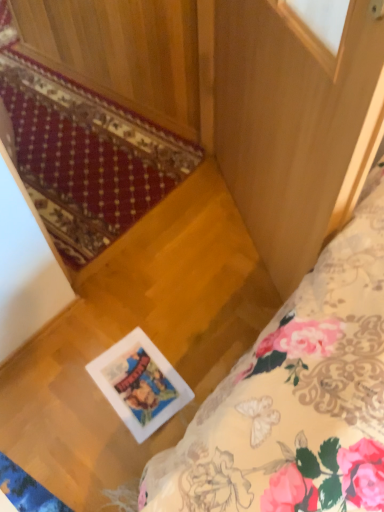
Question: From a real-world perspective, is white glossy picture frame at center on top of floral fabric bed at lower right?

Choices:
 (A) yes
 (B) no

Answer: (B)

Question: Considering the relative sizes of white glossy picture frame at center and floral fabric bed at lower right in the image provided, is white glossy picture frame at center smaller than floral fabric bed at lower right?

Choices:
 (A) no
 (B) yes

Answer: (B)

Question: From the image's perspective, would you say white glossy picture frame at center is positioned over floral fabric bed at lower right?

Choices:
 (A) yes
 (B) no

Answer: (B)

Question: Can you confirm if white glossy picture frame at center is thinner than floral fabric bed at lower right?

Choices:
 (A) yes
 (B) no

Answer: (A)

Question: From the image's perspective, would you say white glossy picture frame at center is shown under floral fabric bed at lower right?

Choices:
 (A) no
 (B) yes

Answer: (B)

Question: Is floral fabric bed at lower right taller or shorter than wooden screen door at center?

Choices:
 (A) tall
 (B) short

Answer: (B)

Question: Looking at the image, does floral fabric bed at lower right seem bigger or smaller compared to wooden screen door at center?

Choices:
 (A) small
 (B) big

Answer: (A)

Question: From a real-world perspective, is floral fabric bed at lower right above or below wooden screen door at center?

Choices:
 (A) above
 (B) below

Answer: (B)

Question: Is point (188, 479) positioned closer to the camera than point (276, 140)?

Choices:
 (A) farther
 (B) closer

Answer: (B)

Question: Is floral fabric bed at lower right to the left or to the right of red carpet at lower left in the image?

Choices:
 (A) right
 (B) left

Answer: (A)

Question: Is floral fabric bed at lower right in front of or behind red carpet at lower left in the image?

Choices:
 (A) behind
 (B) front

Answer: (A)

Question: From a real-world perspective, is floral fabric bed at lower right positioned above or below red carpet at lower left?

Choices:
 (A) above
 (B) below

Answer: (B)

Question: Which is correct: floral fabric bed at lower right is inside red carpet at lower left, or outside of it?

Choices:
 (A) outside
 (B) inside

Answer: (A)

Question: From a real-world perspective, is white glossy picture frame at center physically located above or below wooden screen door at center?

Choices:
 (A) above
 (B) below

Answer: (B)

Question: Does point (97, 380) appear closer or farther from the camera than point (337, 133)?

Choices:
 (A) closer
 (B) farther

Answer: (B)